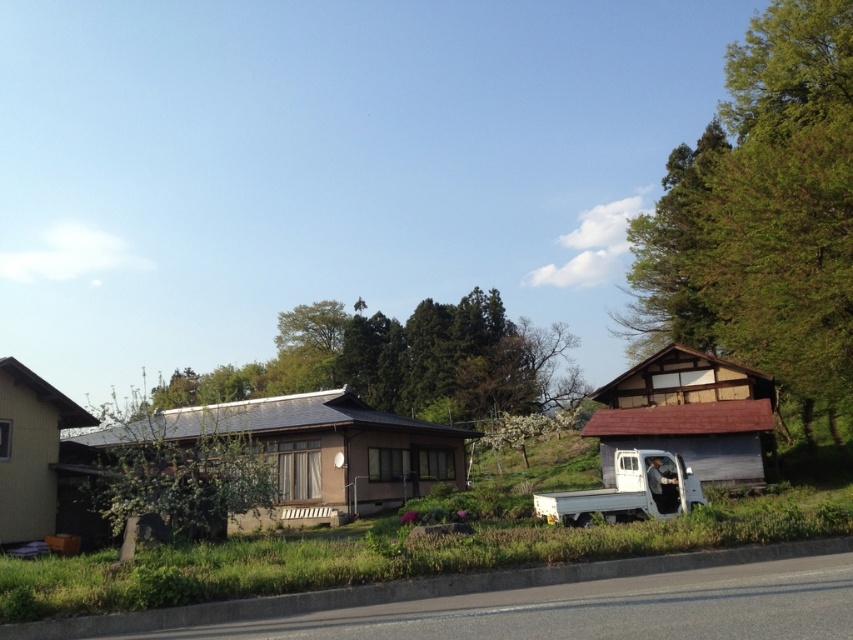
Consider the image. You are standing at the edge of the road and looking towards the two green leafy trees. Which tree, the green leafy tree at right or the green leafy tree at center, appears higher in the image?

The green leafy tree at right appears higher because it is positioned above the green leafy tree at center in the image.

You are standing on the paved road in the scene and want to look at both the green leafy tree at center and the green leafy tree at right. Which tree will appear closer to you?

The green leafy tree at right will appear closer because it is in front of the green leafy tree at center.